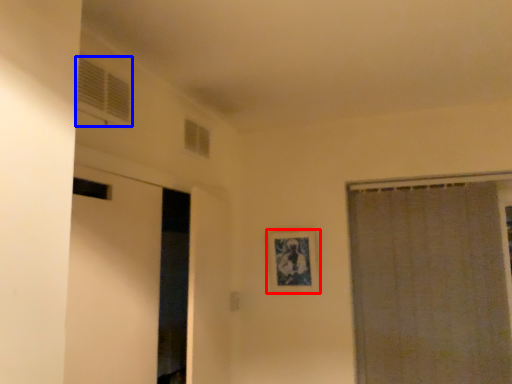
Question: Which object appears closest to the camera in this image, picture frame (highlighted by a red box) or window (highlighted by a blue box)?

Choices:
 (A) picture frame
 (B) window

Answer: (B)